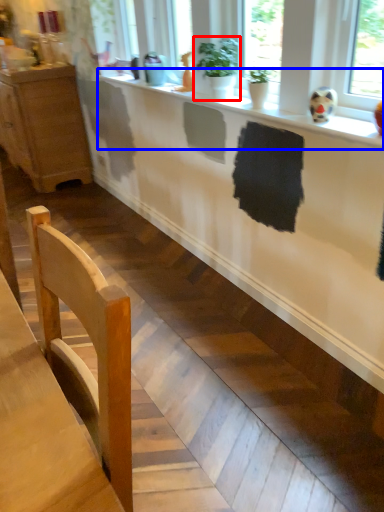
Question: Which object is closer to the camera taking this photo, houseplant (highlighted by a red box) or counter top (highlighted by a blue box)?

Choices:
 (A) houseplant
 (B) counter top

Answer: (B)